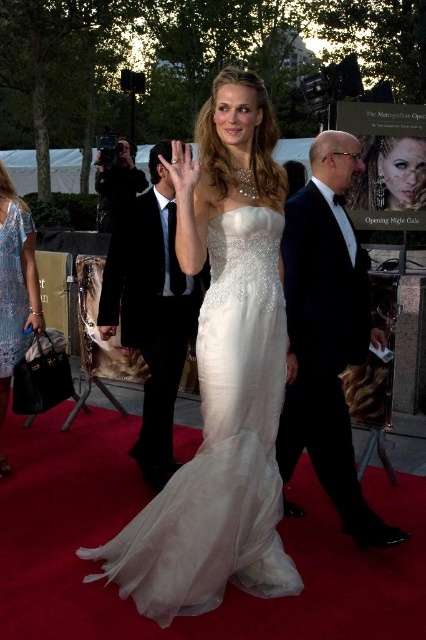
Question: Can you confirm if black satin tuxedo at right is positioned to the left of lace fabric dress at left?

Choices:
 (A) yes
 (B) no

Answer: (B)

Question: Based on their relative distances, which object is nearer to the shiny black suit at center?

Choices:
 (A) shiny blue dress at lower left
 (B) satin/sheer white dress at center

Answer: (A)

Question: Which object appears farthest from the camera in this image?

Choices:
 (A) shiny blue dress at lower left
 (B) satin/sheer white dress at center
 (C) shiny black suit at center
 (D) lace fabric dress at left

Answer: (D)

Question: Among these points, which one is farthest from the camera?

Choices:
 (A) (242, 230)
 (B) (129, 292)
 (C) (2, 266)
 (D) (316, 205)

Answer: (B)

Question: Where is black satin tuxedo at right located in relation to shiny blue dress at lower left in the image?

Choices:
 (A) right
 (B) left

Answer: (A)

Question: Is satin/sheer white dress at center to the left of black satin tuxedo at right from the viewer's perspective?

Choices:
 (A) no
 (B) yes

Answer: (B)